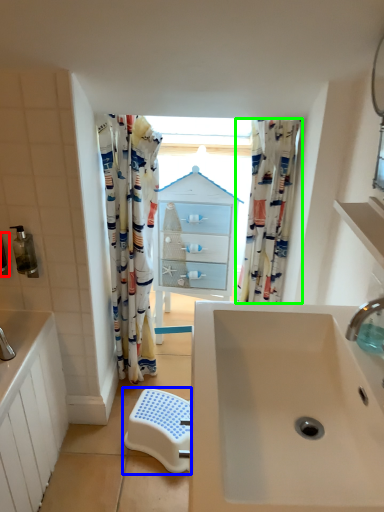
Question: Which object is the closest to the toiletry (highlighted by a red box)? Choose among these: step stool (highlighted by a blue box) or curtain (highlighted by a green box).

Choices:
 (A) step stool
 (B) curtain

Answer: (A)